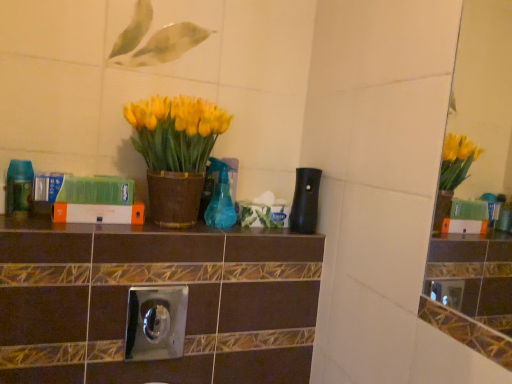
Describe the element at coordinates (305, 201) in the screenshot. I see `black matte bottle at center, which appears as the 3th bottle when viewed from the left` at that location.

You are a GUI agent. You are given a task and a screenshot of the screen. Output one action in this format:
    pyautogui.click(x=<x>, y=<y>)
    Task: Click on the matte brown pot at center
    
    Given the screenshot: What is the action you would take?
    pyautogui.click(x=175, y=152)

The width and height of the screenshot is (512, 384). I want to click on translucent blue spray bottle at center, the 2th bottle viewed from the right, so click(220, 197).

Locate an element on the screen. This screenshot has height=384, width=512. black matte bottle at center, the 1th bottle viewed from the right is located at coordinates (305, 201).

Which is behind, point (5, 200) or point (300, 179)?

Point (300, 179)

Which of these two, translucent green bottle at left, the first bottle positioned from the left, or black matte bottle at center, the 1th bottle viewed from the right, is bigger?

black matte bottle at center, the 1th bottle viewed from the right.

Measure the distance between translucent green bottle at left, the first bottle positioned from the left, and black matte bottle at center, the 1th bottle viewed from the right.

They are 29.49 inches apart.

Can you confirm if matte brown pot at center is smaller than black matte bottle at center, which appears as the 3th bottle when viewed from the left?

Actually, matte brown pot at center might be larger than black matte bottle at center, which appears as the 3th bottle when viewed from the left.

The image size is (512, 384). Identify the location of houseplant lying on the left of black matte bottle at center, the 1th bottle viewed from the right. pyautogui.click(x=175, y=152).

Does point (158, 155) lie in front of point (313, 208)?

Yes, point (158, 155) is in front of point (313, 208).

Which object is positioned more to the left, matte brown pot at center or black matte bottle at center, which appears as the 3th bottle when viewed from the left?

Positioned to the left is matte brown pot at center.

How much distance is there between black matte bottle at center, the 1th bottle viewed from the right, and translucent green bottle at left, which appears as the 3th bottle when viewed from the right?

black matte bottle at center, the 1th bottle viewed from the right, and translucent green bottle at left, which appears as the 3th bottle when viewed from the right, are 29.49 inches apart from each other.

Can you confirm if black matte bottle at center, which appears as the 3th bottle when viewed from the left, is thinner than translucent green bottle at left, the first bottle positioned from the left?

In fact, black matte bottle at center, which appears as the 3th bottle when viewed from the left, might be wider than translucent green bottle at left, the first bottle positioned from the left.

Is black matte bottle at center, the 1th bottle viewed from the right, looking in the opposite direction of translucent green bottle at left, which appears as the 3th bottle when viewed from the right?

No, translucent green bottle at left, which appears as the 3th bottle when viewed from the right, is not at the back of black matte bottle at center, the 1th bottle viewed from the right.

From the image's perspective, between black matte bottle at center, the 1th bottle viewed from the right, and translucent green bottle at left, the first bottle positioned from the left, which one is located above?

From the image's view, translucent green bottle at left, the first bottle positioned from the left, is above.

Between translucent green bottle at left, which appears as the 3th bottle when viewed from the right, and matte brown pot at center, which one appears on the left side from the viewer's perspective?

translucent green bottle at left, which appears as the 3th bottle when viewed from the right.

From a real-world perspective, which is physically below, translucent green bottle at left, which appears as the 3th bottle when viewed from the right, or matte brown pot at center?

translucent green bottle at left, which appears as the 3th bottle when viewed from the right, from a real-world perspective.

Between translucent green bottle at left, which appears as the 3th bottle when viewed from the right, and matte brown pot at center, which one has larger size?

matte brown pot at center.

Looking at this image, which of these two, translucent green bottle at left, the first bottle positioned from the left, or matte brown pot at center, stands shorter?

With less height is translucent green bottle at left, the first bottle positioned from the left.

Is the position of translucent blue spray bottle at center, which is the second bottle in left-to-right order, less distant than that of black matte bottle at center, the 1th bottle viewed from the right?

Yes, translucent blue spray bottle at center, which is the second bottle in left-to-right order, is closer to the viewer.

From a real-world perspective, is translucent blue spray bottle at center, the 2th bottle viewed from the right, physically above black matte bottle at center, the 1th bottle viewed from the right?

No.

Find the location of a particular element. bottle that appears below the translucent blue spray bottle at center, which is the second bottle in left-to-right order (from the image's perspective) is located at coordinates (305, 201).

Are translucent blue spray bottle at center, which is the second bottle in left-to-right order, and black matte bottle at center, the 1th bottle viewed from the right, making contact?

translucent blue spray bottle at center, which is the second bottle in left-to-right order, and black matte bottle at center, the 1th bottle viewed from the right, are clearly separated.

Which point is more forward, (305,229) or (222,210)?

Point (305,229)

Does black matte bottle at center, the 1th bottle viewed from the right, have a lesser height compared to translucent blue spray bottle at center, which is the second bottle in left-to-right order?

No, black matte bottle at center, the 1th bottle viewed from the right, is not shorter than translucent blue spray bottle at center, which is the second bottle in left-to-right order.

Is black matte bottle at center, which appears as the 3th bottle when viewed from the left, not close to translucent blue spray bottle at center, which is the second bottle in left-to-right order?

black matte bottle at center, which appears as the 3th bottle when viewed from the left, is actually quite close to translucent blue spray bottle at center, which is the second bottle in left-to-right order.

Can you confirm if black matte bottle at center, which appears as the 3th bottle when viewed from the left, is smaller than translucent blue spray bottle at center, which is the second bottle in left-to-right order?

Correct, black matte bottle at center, which appears as the 3th bottle when viewed from the left, occupies less space than translucent blue spray bottle at center, which is the second bottle in left-to-right order.

Considering the relative positions of matte brown pot at center and translucent green bottle at left, which appears as the 3th bottle when viewed from the right, in the image provided, is matte brown pot at center to the right of translucent green bottle at left, which appears as the 3th bottle when viewed from the right, from the viewer's perspective?

Yes.

From the picture: Is matte brown pot at center bigger or smaller than translucent green bottle at left, which appears as the 3th bottle when viewed from the right?

matte brown pot at center is bigger than translucent green bottle at left, which appears as the 3th bottle when viewed from the right.

Considering the relative sizes of matte brown pot at center and translucent green bottle at left, which appears as the 3th bottle when viewed from the right, in the image provided, is matte brown pot at center thinner than translucent green bottle at left, which appears as the 3th bottle when viewed from the right,?

Incorrect, the width of matte brown pot at center is not less than that of translucent green bottle at left, which appears as the 3th bottle when viewed from the right.

From the image's perspective, does matte brown pot at center appear higher than translucent green bottle at left, the first bottle positioned from the left?

Yes, from the image's perspective, matte brown pot at center is over translucent green bottle at left, the first bottle positioned from the left.

There is a translucent green bottle at left, the first bottle positioned from the left. At what (x,y) coordinates should I click in order to perform the action: click on the 2nd bottle above it (from a real-world perspective). Please return your answer as a coordinate pair (x, y). Image resolution: width=512 pixels, height=384 pixels. Looking at the image, I should click on (305, 201).

Identify the location of houseplant on the left of black matte bottle at center, which appears as the 3th bottle when viewed from the left. The width and height of the screenshot is (512, 384). (175, 152).

Which object lies nearer to the anchor point translucent green bottle at left, the first bottle positioned from the left, black matte bottle at center, the 1th bottle viewed from the right, or translucent blue spray bottle at center, which is the second bottle in left-to-right order?

Based on the image, translucent blue spray bottle at center, which is the second bottle in left-to-right order, appears to be nearer to translucent green bottle at left, the first bottle positioned from the left.

From the image, which object appears to be nearer to black matte bottle at center, the 1th bottle viewed from the right, translucent green bottle at left, the first bottle positioned from the left, or matte brown pot at center?

The object closer to black matte bottle at center, the 1th bottle viewed from the right, is matte brown pot at center.

Based on their spatial positions, is matte brown pot at center or translucent blue spray bottle at center, which is the second bottle in left-to-right order, closer to black matte bottle at center, the 1th bottle viewed from the right?

The object closer to black matte bottle at center, the 1th bottle viewed from the right, is translucent blue spray bottle at center, which is the second bottle in left-to-right order.

When comparing their distances from matte brown pot at center, does translucent blue spray bottle at center, the 2th bottle viewed from the right, or black matte bottle at center, which appears as the 3th bottle when viewed from the left, seem further?

The object further to matte brown pot at center is black matte bottle at center, which appears as the 3th bottle when viewed from the left.

Looking at the image, which one is located further to translucent green bottle at left, which appears as the 3th bottle when viewed from the right, matte brown pot at center or translucent blue spray bottle at center, which is the second bottle in left-to-right order?

The object further to translucent green bottle at left, which appears as the 3th bottle when viewed from the right, is translucent blue spray bottle at center, which is the second bottle in left-to-right order.

Based on their spatial positions, is translucent green bottle at left, which appears as the 3th bottle when viewed from the right, or black matte bottle at center, which appears as the 3th bottle when viewed from the left, further from translucent blue spray bottle at center, the 2th bottle viewed from the right?

translucent green bottle at left, which appears as the 3th bottle when viewed from the right.

Based on their spatial positions, is translucent blue spray bottle at center, which is the second bottle in left-to-right order, or black matte bottle at center, which appears as the 3th bottle when viewed from the left, further from translucent green bottle at left, the first bottle positioned from the left?

The object further to translucent green bottle at left, the first bottle positioned from the left, is black matte bottle at center, which appears as the 3th bottle when viewed from the left.

Consider the image. From the image, which object appears to be nearer to black matte bottle at center, the 1th bottle viewed from the right, translucent green bottle at left, the first bottle positioned from the left, or translucent blue spray bottle at center, which is the second bottle in left-to-right order?

translucent blue spray bottle at center, which is the second bottle in left-to-right order, is positioned closer to the anchor black matte bottle at center, the 1th bottle viewed from the right.

The height and width of the screenshot is (384, 512). What are the coordinates of `bottle situated between translucent green bottle at left, which appears as the 3th bottle when viewed from the right, and black matte bottle at center, the 1th bottle viewed from the right, from left to right` in the screenshot? It's located at (220, 197).

At what (x,y) coordinates should I click in order to perform the action: click on houseplant between translucent green bottle at left, the first bottle positioned from the left, and black matte bottle at center, the 1th bottle viewed from the right, in the horizontal direction. Please return your answer as a coordinate pair (x, y). Looking at the image, I should click on (175, 152).

The image size is (512, 384). Identify the location of houseplant between translucent green bottle at left, which appears as the 3th bottle when viewed from the right, and translucent blue spray bottle at center, which is the second bottle in left-to-right order. (175, 152).

Locate an element on the screen. bottle situated between matte brown pot at center and black matte bottle at center, the 1th bottle viewed from the right, from left to right is located at coordinates (220, 197).